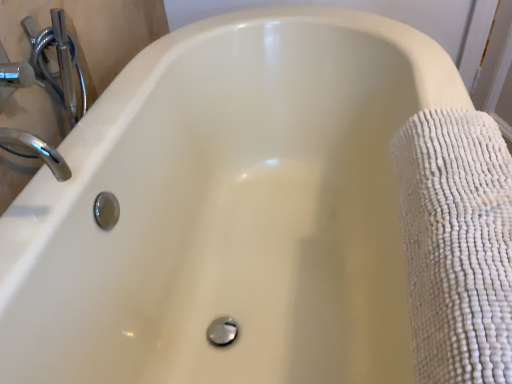
Question: Relative to white textured towel at right, is chrome/metallic faucet at upper left in front or behind?

Choices:
 (A) front
 (B) behind

Answer: (B)

Question: From the image's perspective, relative to white textured towel at right, is chrome/metallic faucet at upper left above or below?

Choices:
 (A) below
 (B) above

Answer: (B)

Question: Is chrome/metallic faucet at upper left wider or thinner than white textured towel at right?

Choices:
 (A) thin
 (B) wide

Answer: (A)

Question: Is point [406, 152] positioned closer to the camera than point [66, 67]?

Choices:
 (A) closer
 (B) farther

Answer: (A)

Question: From their relative heights in the image, would you say white textured towel at right is taller or shorter than chrome/metallic faucet at upper left?

Choices:
 (A) tall
 (B) short

Answer: (A)

Question: From a real-world perspective, relative to chrome/metallic faucet at upper left, is white textured towel at right vertically above or below?

Choices:
 (A) below
 (B) above

Answer: (A)

Question: Would you say white textured towel at right is inside or outside chrome/metallic faucet at upper left?

Choices:
 (A) inside
 (B) outside

Answer: (B)